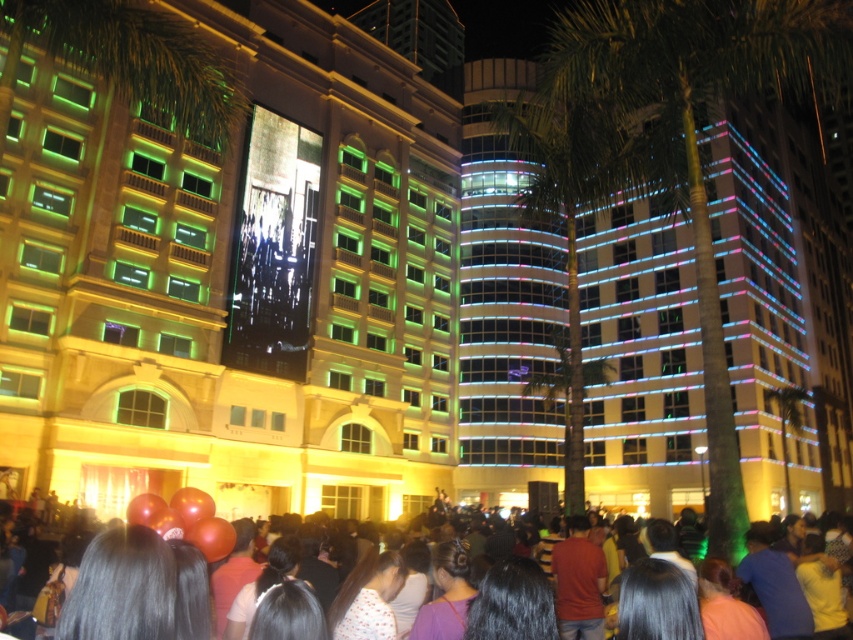
Question: Does matte red balloons at lower center lie in front of green leafy palm tree at center?

Choices:
 (A) yes
 (B) no

Answer: (A)

Question: Which of the following is the closest to the observer?

Choices:
 (A) green leafy palm tree at center
 (B) matte gold building at center

Answer: (B)

Question: Among these points, which one is farthest from the camera?

Choices:
 (A) (201, 544)
 (B) (729, 404)

Answer: (B)

Question: Is matte gold building at center further to camera compared to matte red balloons at lower center?

Choices:
 (A) no
 (B) yes

Answer: (B)

Question: Considering the relative positions of matte red balloons at lower center and green leafy palm tree at center in the image provided, where is matte red balloons at lower center located with respect to green leafy palm tree at center?

Choices:
 (A) above
 (B) below

Answer: (B)

Question: Which of these objects is positioned farthest from the green leafy palm tree at center?

Choices:
 (A) matte red balloons at lower center
 (B) matte gold building at center

Answer: (A)